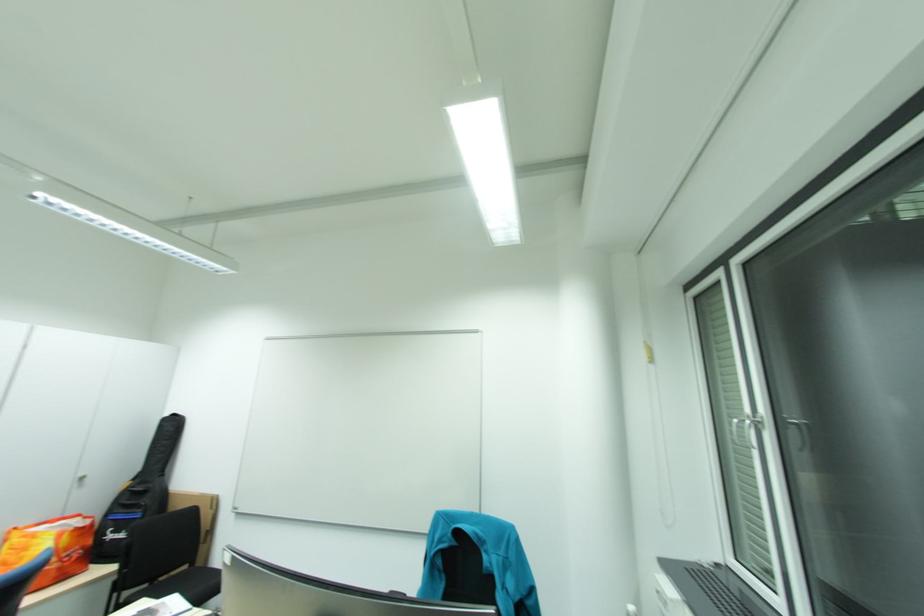
At what (x,y) coordinates should I click in order to perform the action: click on silver window handle. Please return your answer as a coordinate pair (x, y). The height and width of the screenshot is (616, 924). Looking at the image, I should click on (748, 428).